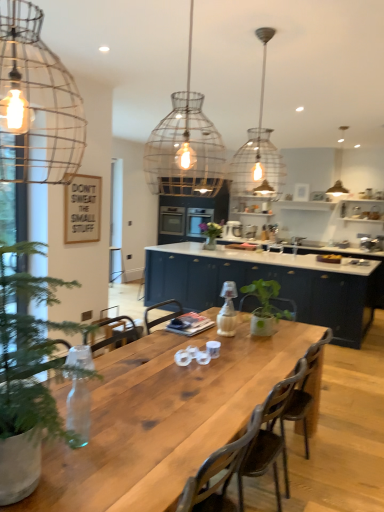
Looking at this image, in order to face brown wooden chair at center, should I rotate leftwards or rightwards?

You should rotate right by 11.438 degrees.

Image resolution: width=384 pixels, height=512 pixels. In order to click on matte blue cabinets at center in this screenshot , I will do [267, 279].

This screenshot has width=384, height=512. Describe the element at coordinates (163, 418) in the screenshot. I see `natural wood table at center` at that location.

This screenshot has height=512, width=384. I want to click on green matte plant at center, marked as the first houseplant in a back-to-front arrangement, so click(265, 307).

This screenshot has width=384, height=512. What do you see at coordinates (337, 175) in the screenshot?
I see `matte glass pendant light at upper right, which appears as the 1th lamp when viewed from the back` at bounding box center [337, 175].

What is the approximate width of clear glass pendant light at upper center, the 2th lamp viewed from the back?

clear glass pendant light at upper center, the 2th lamp viewed from the back, is 15.36 inches in width.

Measure the distance between point (207, 226) and camera.

Point (207, 226) and camera are 6.52 meters apart from each other.

Identify the location of brown wooden chair at center. This screenshot has width=384, height=512. (270, 437).

Considering the sizes of objects natural wood table at center and brown wooden chair at center in the image provided, who is smaller, natural wood table at center or brown wooden chair at center?

With smaller size is brown wooden chair at center.

Which object is wider, natural wood table at center or brown wooden chair at center?

Wider between the two is natural wood table at center.

In the image, is natural wood table at center on the left side or the right side of brown wooden chair at center?

natural wood table at center is positioned on brown wooden chair at center's left side.

From a real-world perspective, between natural wood table at center and brown wooden chair at center, who is vertically higher?

From a 3D spatial view, brown wooden chair at center is above.

Considering the sizes of objects matte glass pendant light at upper right, marked as the third lamp in a front-to-back arrangement, and wire mesh pendant light at center in the image provided, who is wider, matte glass pendant light at upper right, marked as the third lamp in a front-to-back arrangement, or wire mesh pendant light at center?

wire mesh pendant light at center is wider.

Could you tell me if matte glass pendant light at upper right, the first lamp positioned from the right, is facing wire mesh pendant light at center?

Yes.

Is matte glass pendant light at upper right, which is the third lamp in left-to-right order, located outside wire mesh pendant light at center?

That's correct, matte glass pendant light at upper right, which is the third lamp in left-to-right order, is outside of wire mesh pendant light at center.

From the image's perspective, between matte glass pendant light at upper right, which appears as the 1th lamp when viewed from the back, and wire mesh pendant light at center, who is located below?

wire mesh pendant light at center appears lower in the image.

Considering the relative positions of green matte plant at center, marked as the first houseplant in a back-to-front arrangement, and matte blue cabinets at center in the image provided, is green matte plant at center, marked as the first houseplant in a back-to-front arrangement, to the left or to the right of matte blue cabinets at center?

green matte plant at center, marked as the first houseplant in a back-to-front arrangement, is positioned on matte blue cabinets at center's left side.

Is green matte plant at center, the first houseplant viewed from the right, wider than matte blue cabinets at center?

No, green matte plant at center, the first houseplant viewed from the right, is not wider than matte blue cabinets at center.

How far apart are wire mesh pendant light at center and natural wood table at center?

15.13 feet.

What's the angular difference between wire mesh pendant light at center and natural wood table at center's facing directions?

They differ by 176 degrees in their facing directions.

From the image's perspective, does wire mesh pendant light at center appear lower than natural wood table at center?

No, from the image's perspective, wire mesh pendant light at center is not beneath natural wood table at center.

Which is more to the left, wire mesh pendant light at center or natural wood table at center?

natural wood table at center.

From the image's perspective, is green matte plant at center, which ranks as the 2th houseplant in front-to-back order, above or below wire mesh pendant light at center?

green matte plant at center, which ranks as the 2th houseplant in front-to-back order, is situated lower than wire mesh pendant light at center in the image.

Does green matte plant at center, marked as the first houseplant in a back-to-front arrangement, have a greater height compared to wire mesh pendant light at center?

In fact, green matte plant at center, marked as the first houseplant in a back-to-front arrangement, may be shorter than wire mesh pendant light at center.

Is green matte plant at center, the second houseplant when ordered from left to right, not close to wire mesh pendant light at center?

That's right, there is a large distance between green matte plant at center, the second houseplant when ordered from left to right, and wire mesh pendant light at center.

Is green matte vase at center positioned with its back to wire mesh pendant light at upper left, marked as the 3th lamp in a back-to-front arrangement?

green matte vase at center is not turned away from wire mesh pendant light at upper left, marked as the 3th lamp in a back-to-front arrangement.

Considering the sizes of objects green matte vase at center and wire mesh pendant light at upper left, marked as the 3th lamp in a back-to-front arrangement, in the image provided, who is thinner, green matte vase at center or wire mesh pendant light at upper left, marked as the 3th lamp in a back-to-front arrangement,?

wire mesh pendant light at upper left, marked as the 3th lamp in a back-to-front arrangement.

Are green matte vase at center and wire mesh pendant light at upper left, which is the first lamp in front-to-back order, located far from each other?

green matte vase at center is far away from wire mesh pendant light at upper left, which is the first lamp in front-to-back order.

In the scene shown: Is natural wood table at center wider or thinner than wire mesh pendant light at upper left, which is the 3th lamp in right-to-left order?

natural wood table at center is wider than wire mesh pendant light at upper left, which is the 3th lamp in right-to-left order.

Considering the positions of objects natural wood table at center and wire mesh pendant light at upper left, which is the first lamp in front-to-back order, in the image provided, who is in front, natural wood table at center or wire mesh pendant light at upper left, which is the first lamp in front-to-back order,?

wire mesh pendant light at upper left, which is the first lamp in front-to-back order, is more forward.

At what (x,y) coordinates should I click in order to perform the action: click on kitchen & dining room table located on the right of wire mesh pendant light at upper left, which is the 3th lamp in right-to-left order. Please return your answer as a coordinate pair (x, y). This screenshot has width=384, height=512. Looking at the image, I should click on (163, 418).

Identify the location of chair above the natural wood table at center (from the image's perspective). (270, 437).

Where is `lamp that is the 2nd object to the right of the wire mesh pendant light at center, starting at the anchor`? This screenshot has width=384, height=512. lamp that is the 2nd object to the right of the wire mesh pendant light at center, starting at the anchor is located at coordinates [337, 175].

Considering their positions, is green matte plant at center, the second houseplant when ordered from left to right, positioned closer to matte blue cabinets at center than wire mesh pendant light at upper left, which is the first lamp in front-to-back order?

green matte plant at center, the second houseplant when ordered from left to right, is closer to matte blue cabinets at center.

Estimate the real-world distances between objects in this image. Which object is further from green leafy plant at left, which ranks as the first houseplant in front-to-back order, clear glass pendant light at upper center, the 2th lamp viewed from the left, or green matte vase at center?

green matte vase at center is positioned further to the anchor green leafy plant at left, which ranks as the first houseplant in front-to-back order.

Which object lies nearer to the anchor point matte blue cabinets at center, natural wood table at center or clear glass pendant light at upper center, the second lamp in the right-to-left sequence?

The object closer to matte blue cabinets at center is clear glass pendant light at upper center, the second lamp in the right-to-left sequence.

From the picture: Based on their spatial positions, is natural wood table at center or green matte plant at center, marked as the first houseplant in a back-to-front arrangement, further from wire mesh pendant light at center?

Based on the image, natural wood table at center appears to be further to wire mesh pendant light at center.

Looking at the image, which one is located further to matte blue cabinets at center, wire mesh pendant light at center or green matte plant at center, which ranks as the 2th houseplant in front-to-back order?

wire mesh pendant light at center.

Considering their positions, is brown wooden chair at center positioned closer to green matte vase at center than natural wood table at center?

natural wood table at center lies closer to green matte vase at center than the other object.

When comparing their distances from clear glass pendant light at upper center, marked as the 2th lamp in a front-to-back arrangement, does matte glass pendant light at upper right, marked as the third lamp in a front-to-back arrangement, or wire mesh pendant light at upper left, which is the first lamp in front-to-back order, seem closer?

wire mesh pendant light at upper left, which is the first lamp in front-to-back order, lies closer to clear glass pendant light at upper center, marked as the 2th lamp in a front-to-back arrangement, than the other object.

Which object lies further to the anchor point natural wood table at center, green matte plant at center, the second houseplant when ordered from left to right, or green matte vase at center?

Based on the image, green matte vase at center appears to be further to natural wood table at center.

Where is `chair between natural wood table at center and green matte vase at center along the z-axis`? The image size is (384, 512). chair between natural wood table at center and green matte vase at center along the z-axis is located at coordinates (270, 437).

Where is `chair located between wire mesh pendant light at center and green matte vase at center in the depth direction`? The height and width of the screenshot is (512, 384). chair located between wire mesh pendant light at center and green matte vase at center in the depth direction is located at coordinates (x=270, y=437).

Where is `lamp that lies between wire mesh pendant light at center and green leafy plant at left, which ranks as the first houseplant in front-to-back order, from top to bottom`? The height and width of the screenshot is (512, 384). lamp that lies between wire mesh pendant light at center and green leafy plant at left, which ranks as the first houseplant in front-to-back order, from top to bottom is located at coordinates (36, 103).

Where is `houseplant between clear glass pendant light at upper center, the 2th lamp viewed from the left, and green matte vase at center in the front-back direction`? houseplant between clear glass pendant light at upper center, the 2th lamp viewed from the left, and green matte vase at center in the front-back direction is located at coordinates (265, 307).